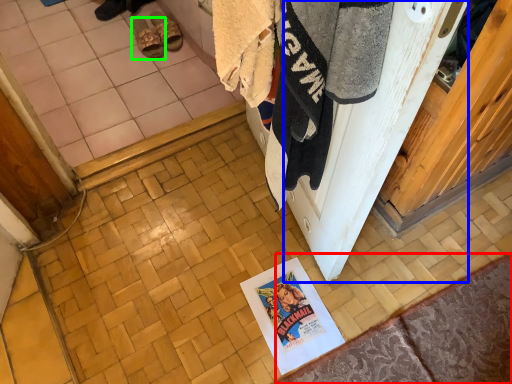
Question: Based on their relative distances, which object is farther from doormat (highlighted by a red box)? Choose from screen door (highlighted by a blue box) and footwear (highlighted by a green box).

Choices:
 (A) screen door
 (B) footwear

Answer: (B)